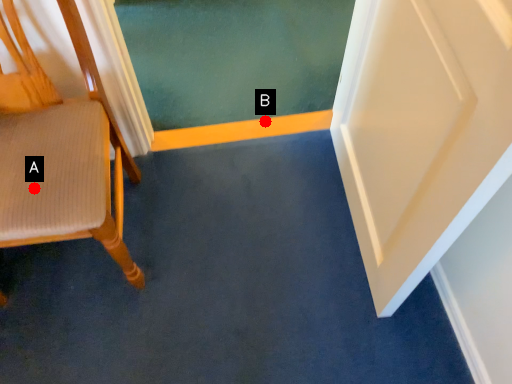
Question: Two points are circled on the image, labeled by A and B beside each circle. Which point appears closest to the camera in this image?

Choices:
 (A) A is closer
 (B) B is closer

Answer: (A)